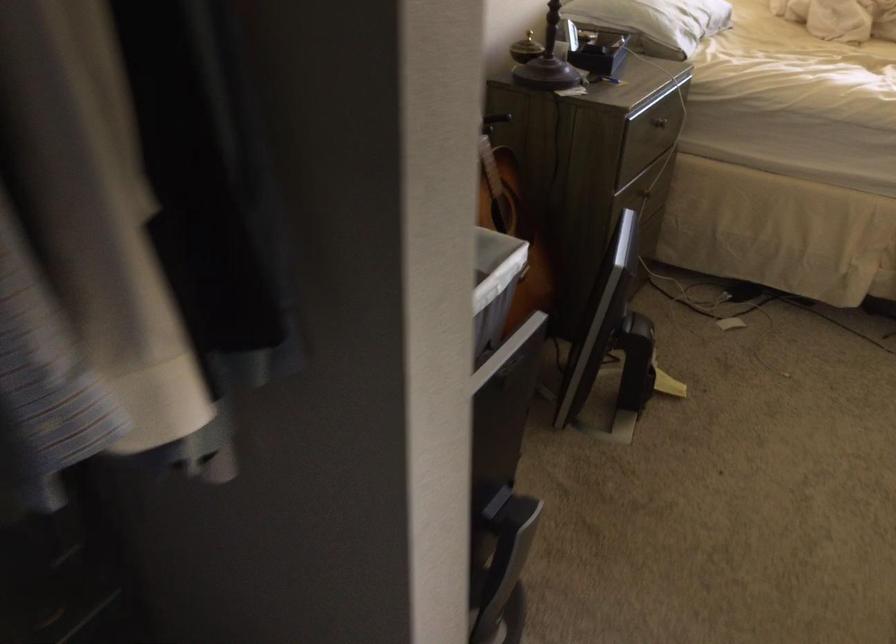
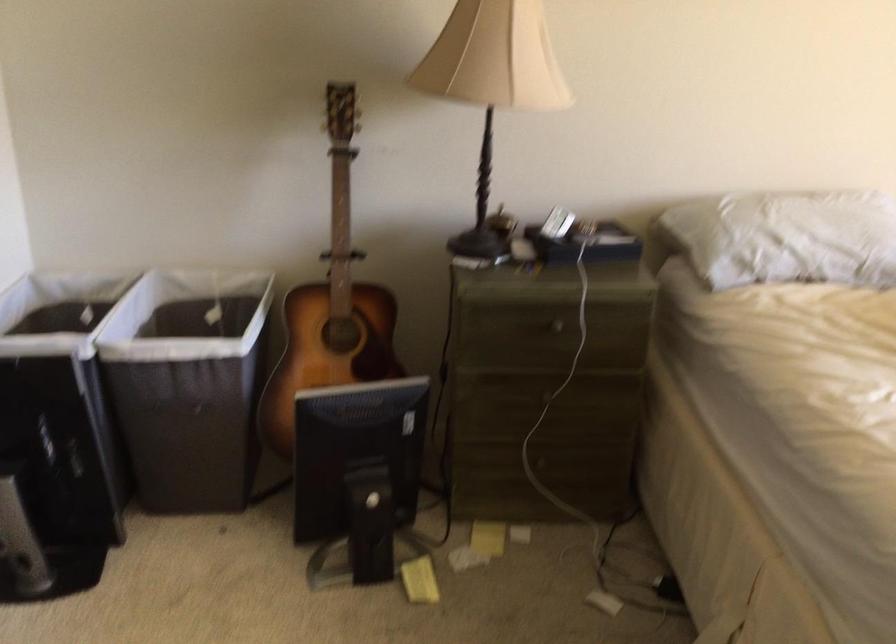
In the second image, find the point that corresponds to (x=479, y=335) in the first image.

(188, 384)